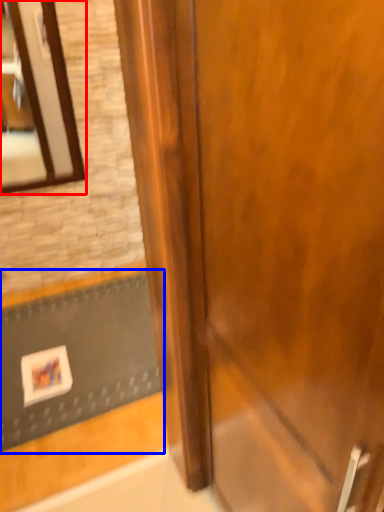
Question: Which object is further to the camera taking this photo, mirror (highlighted by a red box) or doormat (highlighted by a blue box)?

Choices:
 (A) mirror
 (B) doormat

Answer: (A)